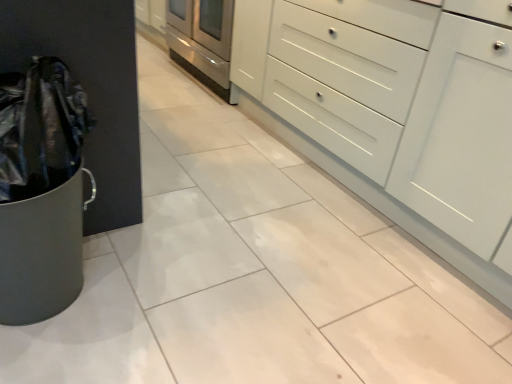
Question: Considering the relative sizes of white glossy cabinet at center and stainless steel oven at center in the image provided, is white glossy cabinet at center smaller than stainless steel oven at center?

Choices:
 (A) yes
 (B) no

Answer: (B)

Question: Could you tell me if white glossy cabinet at center is turned towards stainless steel oven at center?

Choices:
 (A) yes
 (B) no

Answer: (B)

Question: Is white glossy cabinet at center far from stainless steel oven at center?

Choices:
 (A) yes
 (B) no

Answer: (A)

Question: Is white glossy cabinet at center not inside stainless steel oven at center?

Choices:
 (A) yes
 (B) no

Answer: (A)

Question: Does white glossy cabinet at center have a lesser width compared to stainless steel oven at center?

Choices:
 (A) yes
 (B) no

Answer: (A)

Question: Considering the relative sizes of white glossy cabinet at center and stainless steel oven at center in the image provided, is white glossy cabinet at center shorter than stainless steel oven at center?

Choices:
 (A) yes
 (B) no

Answer: (B)

Question: Does stainless steel oven at center contain white glossy cabinet at center?

Choices:
 (A) yes
 (B) no

Answer: (B)

Question: Considering the relative positions of stainless steel oven at center and white glossy cabinet at center in the image provided, is stainless steel oven at center to the left of white glossy cabinet at center from the viewer's perspective?

Choices:
 (A) yes
 (B) no

Answer: (A)

Question: From the image's perspective, does stainless steel oven at center appear higher than white glossy cabinet at center?

Choices:
 (A) no
 (B) yes

Answer: (B)

Question: Does stainless steel oven at center have a greater height compared to white glossy cabinet at center?

Choices:
 (A) no
 (B) yes

Answer: (A)

Question: Is stainless steel oven at center facing away from white glossy cabinet at center?

Choices:
 (A) yes
 (B) no

Answer: (B)

Question: From a real-world perspective, is stainless steel oven at center located beneath white glossy cabinet at center?

Choices:
 (A) no
 (B) yes

Answer: (B)

Question: Is stainless steel oven at center bigger or smaller than white glossy cabinet at center?

Choices:
 (A) big
 (B) small

Answer: (B)